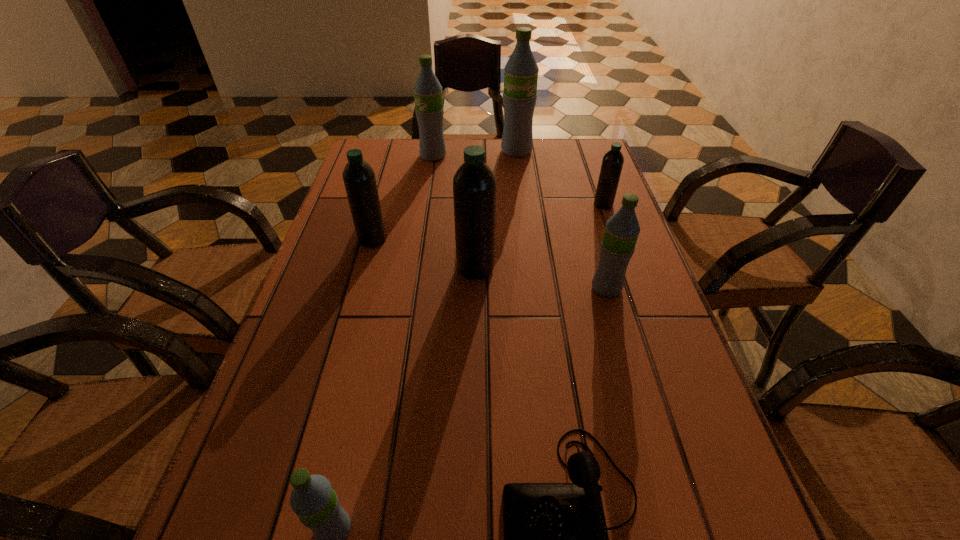
Where is `green water bottle that stands as the closest to the second biggest green water bottle`? The width and height of the screenshot is (960, 540). green water bottle that stands as the closest to the second biggest green water bottle is located at coordinates (521, 71).

Identify which black water bottle is located as the nearest to the nearest green water bottle. Please provide its 2D coordinates. Your answer should be formatted as a tuple, i.e. [(x, y)], where the tuple contains the x and y coordinates of a point satisfying the conditions above.

[(474, 184)]

Locate an element on the screen. Image resolution: width=960 pixels, height=540 pixels. the closest black water bottle to the rightmost green water bottle is located at coordinates (474, 184).

At what (x,y) coordinates should I click in order to perform the action: click on free space that satisfies the following two spatial constraints: 1. on the back side of the third smallest green water bottle; 2. on the right side of the second biggest black water bottle. Please return your answer as a coordinate pair (x, y). Looking at the image, I should click on tap(396, 156).

This screenshot has width=960, height=540. Find the location of `free region that satisfies the following two spatial constraints: 1. on the back side of the second farthest black water bottle; 2. on the left side of the third farthest water bottle`. free region that satisfies the following two spatial constraints: 1. on the back side of the second farthest black water bottle; 2. on the left side of the third farthest water bottle is located at coordinates (382, 205).